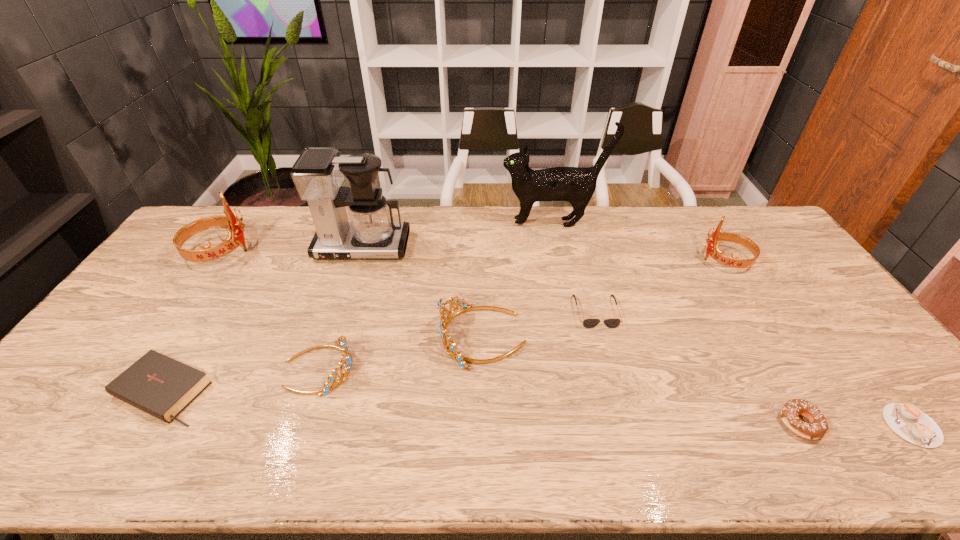
Locate which object is the eighth closest to the rightmost object. Please provide its 2D coordinates. Your answer should be formatted as a tuple, i.e. [(x, y)], where the tuple contains the x and y coordinates of a point satisfying the conditions above.

[(163, 387)]

Identify the location of object identified as the fourth closest to the right gold tiara. The image size is (960, 540). (576, 185).

Where is `tiara that is the third nearest to the gray coffee maker`? This screenshot has height=540, width=960. tiara that is the third nearest to the gray coffee maker is located at coordinates (346, 363).

Select which tiara is the third closest to the sixth tallest object. Please provide its 2D coordinates. Your answer should be formatted as a tuple, i.e. [(x, y)], where the tuple contains the x and y coordinates of a point satisfying the conditions above.

[(712, 249)]

Identify the location of vacant space that satisfies the following two spatial constraints: 1. on the front-facing side of the second tallest tiara; 2. on the front-facing side of the sunglasses. (758, 312).

The image size is (960, 540). Identify the location of vacant space that satisfies the following two spatial constraints: 1. on the front-facing side of the white cappuccino; 2. on the right side of the tallest tiara. (99, 425).

The height and width of the screenshot is (540, 960). Identify the location of free location that satisfies the following two spatial constraints: 1. on the front side of the Bible; 2. on the left side of the cappuccino. click(141, 425).

Locate an element on the screen. This screenshot has height=540, width=960. vacant area in the image that satisfies the following two spatial constraints: 1. on the front-facing side of the right red tiara; 2. on the front-facing side of the black sunglasses is located at coordinates (758, 312).

Where is `free location that satisfies the following two spatial constraints: 1. on the front-facing side of the fifth tallest object; 2. on the front side of the Bible`? The width and height of the screenshot is (960, 540). free location that satisfies the following two spatial constraints: 1. on the front-facing side of the fifth tallest object; 2. on the front side of the Bible is located at coordinates pyautogui.click(x=483, y=391).

I want to click on vacant space that satisfies the following two spatial constraints: 1. on the front-facing side of the doughnut; 2. on the right side of the second shortest tiara, so click(x=484, y=423).